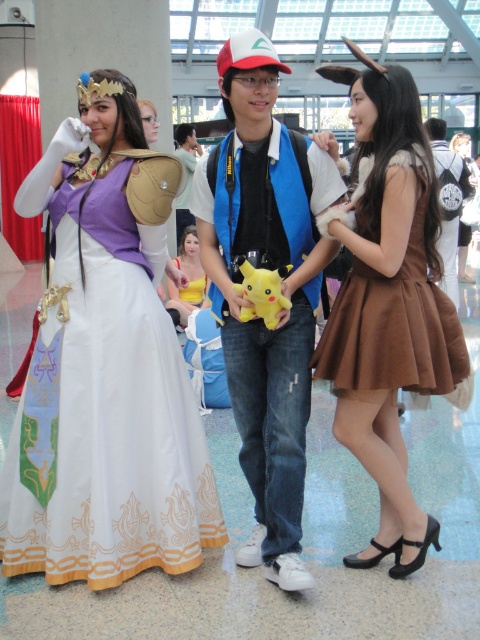
Question: Does white satin dress at center have a lesser width compared to brown satin dress at center?

Choices:
 (A) no
 (B) yes

Answer: (A)

Question: Which of the following is the farthest from the observer?

Choices:
 (A) white satin dress at center
 (B) brown suede dress at right
 (C) brown satin dress at center

Answer: (A)

Question: Which point is closer to the camera?

Choices:
 (A) (147, 528)
 (B) (351, 108)
 (C) (447, 387)

Answer: (C)

Question: Does white satin dress at center have a smaller size compared to brown suede dress at right?

Choices:
 (A) no
 (B) yes

Answer: (A)

Question: Does white satin dress at center appear under brown suede dress at right?

Choices:
 (A) no
 (B) yes

Answer: (B)

Question: Which point is farther from the camera taking this photo?

Choices:
 (A) (360, 262)
 (B) (334, 205)

Answer: (B)